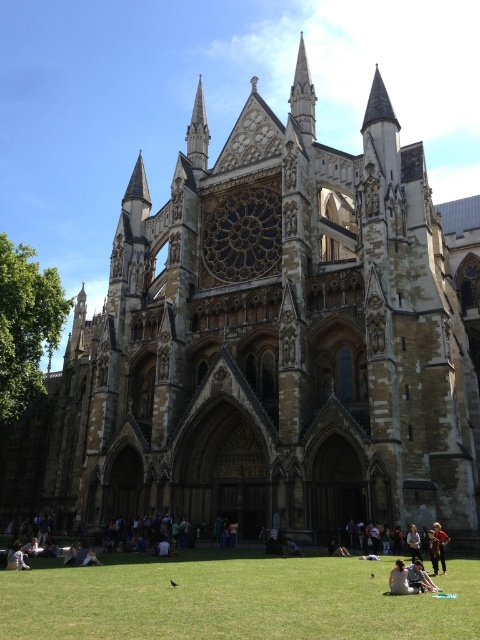
Question: Is light brown leather jacket at lower center bigger than dark blue jeans at lower center?

Choices:
 (A) no
 (B) yes

Answer: (A)

Question: Which object is closer to the camera taking this photo?

Choices:
 (A) dark blue jeans at lower center
 (B) blue denim jeans at center
 (C) green grass at lower center

Answer: (C)

Question: Does green grass at lower center have a smaller size compared to dark blue jeans at lower center?

Choices:
 (A) no
 (B) yes

Answer: (A)

Question: Can you confirm if dark blue jeans at lower center is wider than blue denim jeans at center?

Choices:
 (A) yes
 (B) no

Answer: (A)

Question: Which object is positioned farthest from the blue denim jeans at center?

Choices:
 (A) dark blue jeans at lower center
 (B) light brown leather jacket at lower center
 (C) green grass at lower center

Answer: (B)

Question: Which object is farther from the camera taking this photo?

Choices:
 (A) light brown leather jacket at lower center
 (B) light brown hair at lower center
 (C) green grass at lower center
 (D) dark blue jeans at lower center

Answer: (D)